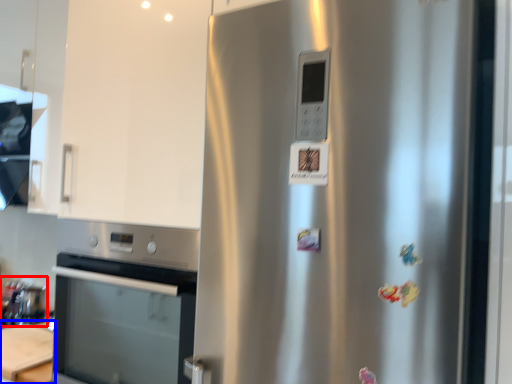
Question: Among these objects, which one is nearest to the camera, appliance (highlighted by a red box) or table (highlighted by a blue box)?

Choices:
 (A) appliance
 (B) table

Answer: (B)